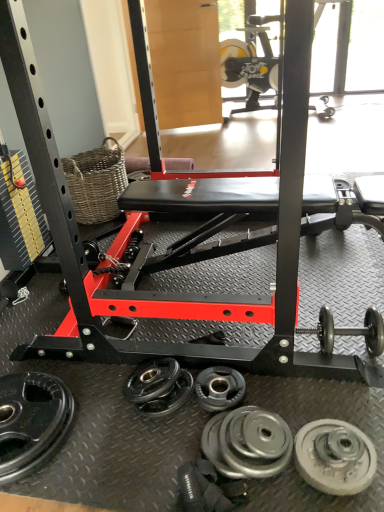
Identify the location of free spot to the right of black rubber weight plate at center, the 2th wheel in the left-to-right sequence. (276, 393).